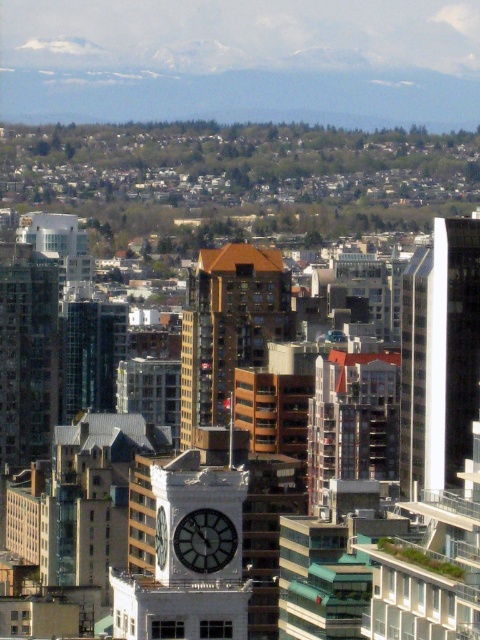
You are an architect analyzing the city layout. From your vantage point, does the white stone clock tower at center appear higher or lower than the glassy reflective skyscraper at left?

The white stone clock tower at center is below the glassy reflective skyscraper at left, so it appears lower.

You are a city planner assessing the skyline. You need to determine if the brown wood grain building at center can be seen from the glassy reflective skyscraper at left. Based on their sizes and positions, can the skyscraper block the view of the smaller building?

The brown wood grain building at center is smaller in size compared to the glassy reflective skyscraper at left. Since the skyscraper is larger and positioned to the left, it might block the view of the smaller building depending on their exact arrangement.